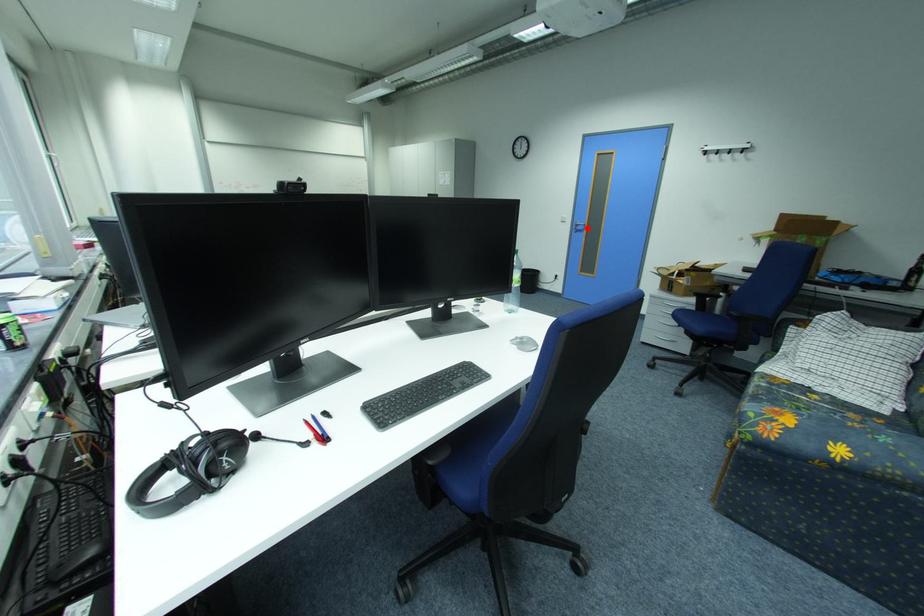
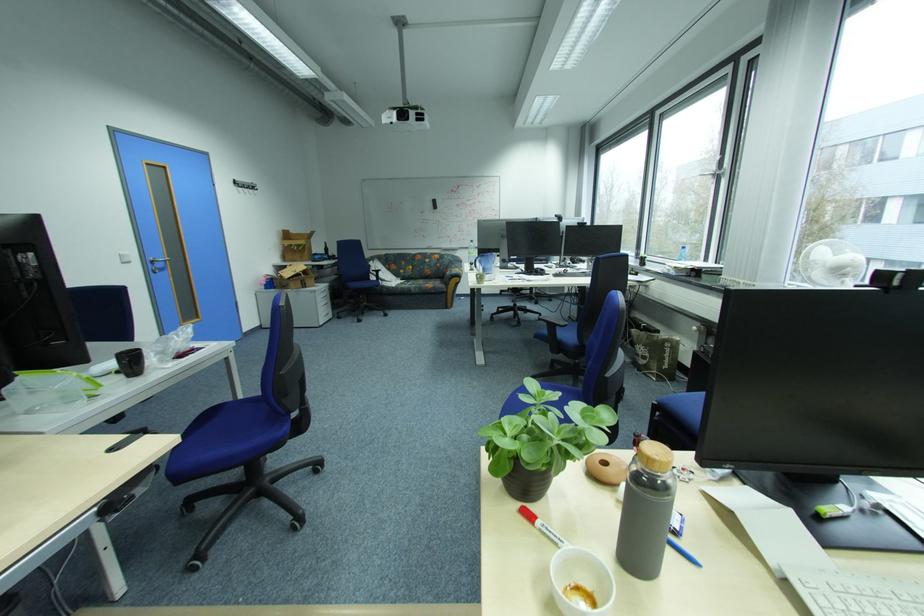
Find the pixel in the second image that matches the highlighted location in the first image.

(167, 265)